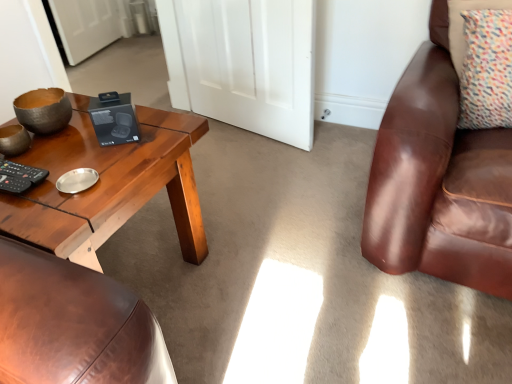
The image size is (512, 384). What are the coordinates of `free spot below woodenmaterial/texturecoffee table at left (from a real-world perspective)` in the screenshot? It's located at (141, 264).